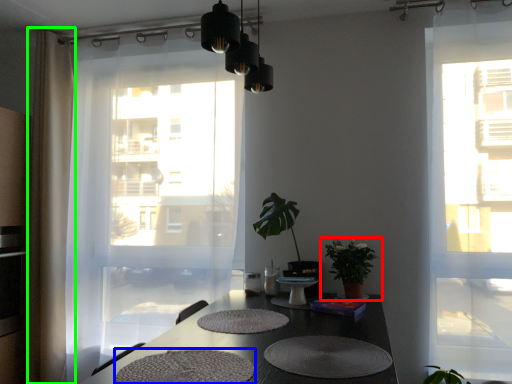
Question: Based on their relative distances, which object is farther from houseplant (highlighted by a red box)? Choose from wide (highlighted by a blue box) and curtain (highlighted by a green box).

Choices:
 (A) wide
 (B) curtain

Answer: (B)